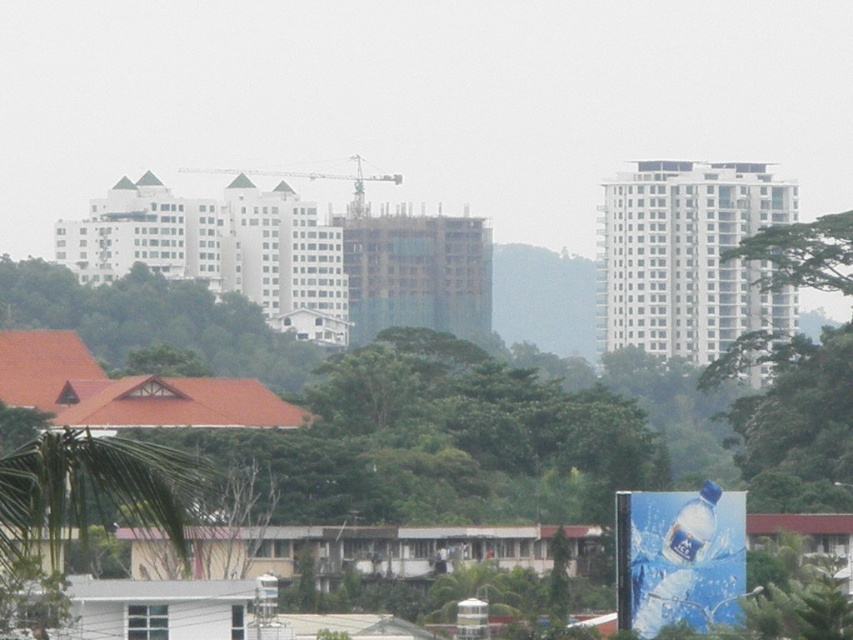
You are a city planner reviewing this area. You need to determine if the green leafy tree at right is within the 1500 feet safety zone required for new construction projects. Is it within the zone?

The green leafy tree at right is 1800.69 feet away from the viewer, which is beyond the 1500 feet safety zone required for new construction projects. Therefore, it is outside the zone.

In the scene shown: You are standing in the cityscape and want to locate a specific point marked at coordinates point (792, 416). Based on the scene description, can you determine which object this point is located on?

The point (792, 416) is located on the green leafy tree at right.